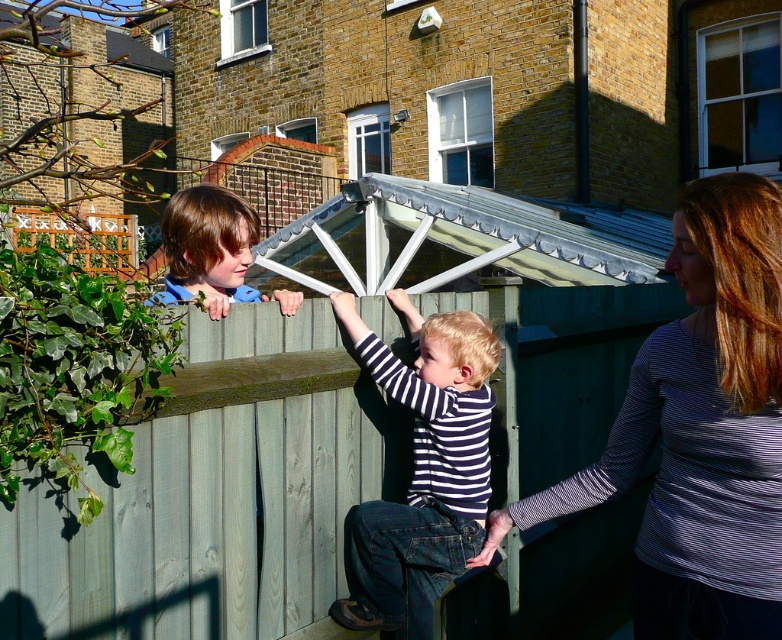
Question: From the image, what is the correct spatial relationship of green wood fence at center in relation to striped cotton shirt at center?

Choices:
 (A) right
 (B) left

Answer: (A)

Question: Can you confirm if green wood fence at center is thinner than striped long-sleeve shirt at center?

Choices:
 (A) no
 (B) yes

Answer: (A)

Question: Based on their relative distances, which object is nearer to the green wood fence at center?

Choices:
 (A) matte brown hair at upper left
 (B) striped long-sleeve shirt at center
 (C) striped cotton shirt at center

Answer: (C)

Question: Which object is farther from the camera taking this photo?

Choices:
 (A) matte brown hair at upper left
 (B) green wood fence at center

Answer: (B)

Question: Is green wood fence at center positioned in front of matte brown hair at upper left?

Choices:
 (A) no
 (B) yes

Answer: (A)

Question: Which object is farther from the camera taking this photo?

Choices:
 (A) striped cotton shirt at center
 (B) green wood fence at center

Answer: (B)